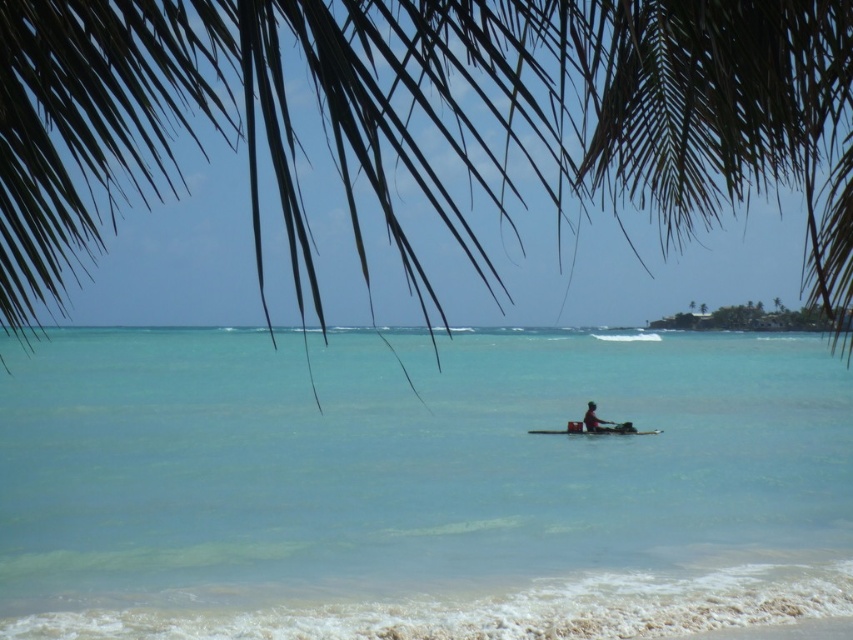
Which is in front, point (706, 604) or point (635, 433)?

Point (706, 604) is in front.

The image size is (853, 640). What do you see at coordinates (419, 486) in the screenshot?
I see `clear blue water at center` at bounding box center [419, 486].

Where is `clear blue water at center`? clear blue water at center is located at coordinates (419, 486).

Which is behind, point (231, 508) or point (813, 92)?

The point (231, 508) is more distant.

What do you see at coordinates (419, 486) in the screenshot? This screenshot has height=640, width=853. I see `clear blue water at center` at bounding box center [419, 486].

Describe the element at coordinates (419, 486) in the screenshot. This screenshot has height=640, width=853. I see `clear blue water at center` at that location.

Identify the location of clear blue water at center. (419, 486).

Which is above, green leafy palm tree at upper center or smooth wooden paddleboard at center?

green leafy palm tree at upper center is above.

Does green leafy palm tree at upper center have a lesser height compared to smooth wooden paddleboard at center?

In fact, green leafy palm tree at upper center may be taller than smooth wooden paddleboard at center.

Where is `green leafy palm tree at upper center`? green leafy palm tree at upper center is located at coordinates (422, 116).